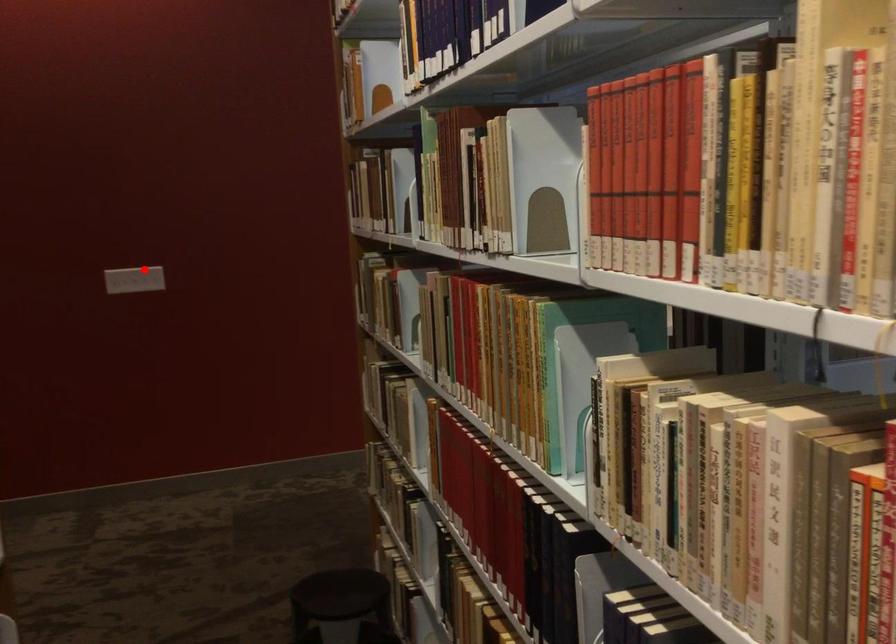
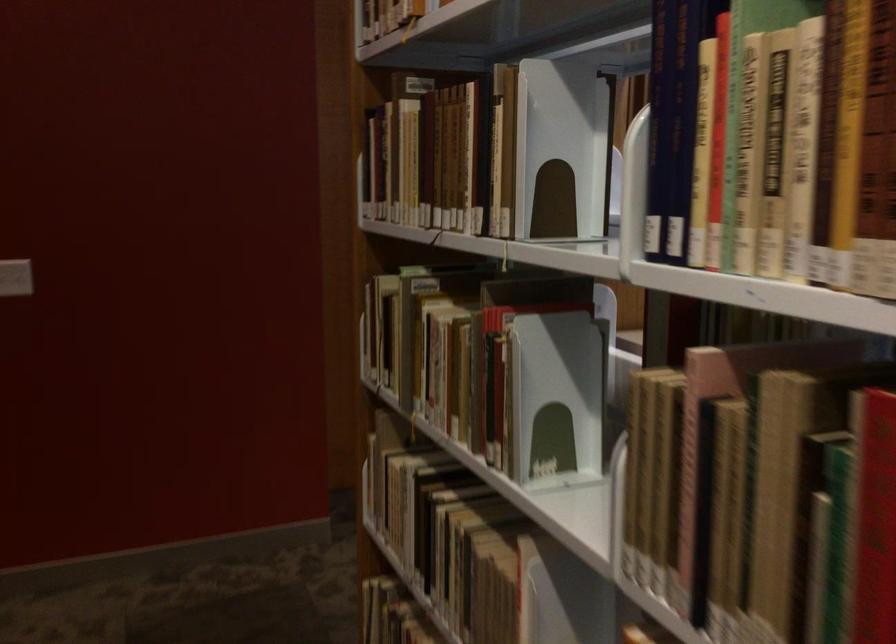
Question: I am providing you with two images of the same scene from different viewpoints. A red point is shown in image1. For the corresponding object point in image2, is it positioned nearer or farther from the camera?

Choices:
 (A) Nearer
 (B) Farther

Answer: (A)